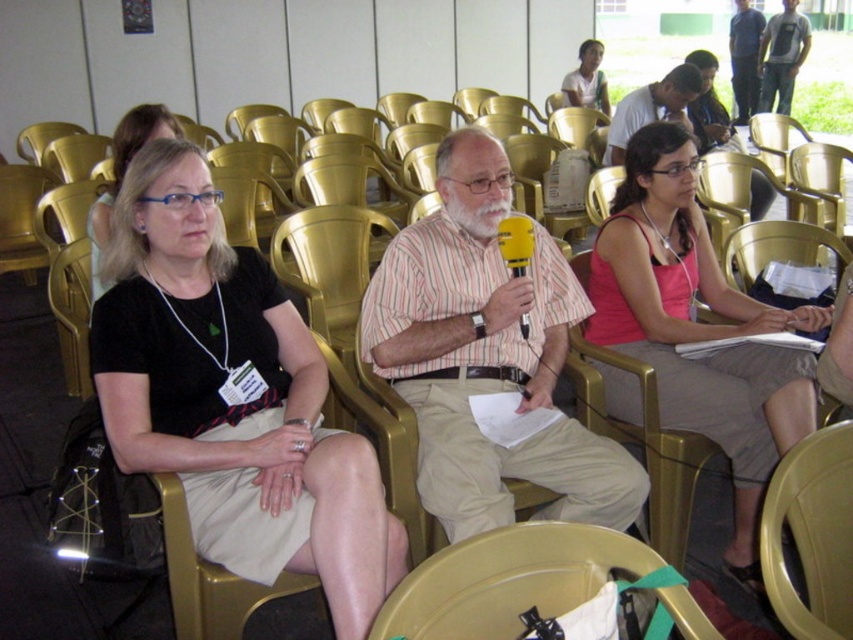
Question: Does striped cotton shirt at center lie in front of dark blue jeans at upper right?

Choices:
 (A) yes
 (B) no

Answer: (A)

Question: Is pink fabric tank top at center positioned behind light brown striped shirt at center?

Choices:
 (A) yes
 (B) no

Answer: (B)

Question: Is metallic gold chair at lower center below light brown striped shirt at center?

Choices:
 (A) no
 (B) yes

Answer: (B)

Question: Among these objects, which one is farthest from the camera?

Choices:
 (A) striped cotton shirt at center
 (B) gray cotton shirt at upper right

Answer: (B)

Question: Which of the following is the closest to the observer?

Choices:
 (A) (474, 323)
 (B) (593, 77)
 (C) (746, 35)

Answer: (A)

Question: Which point is closer to the camera?

Choices:
 (A) matte black shirt at center
 (B) light brown striped shirt at center

Answer: (A)